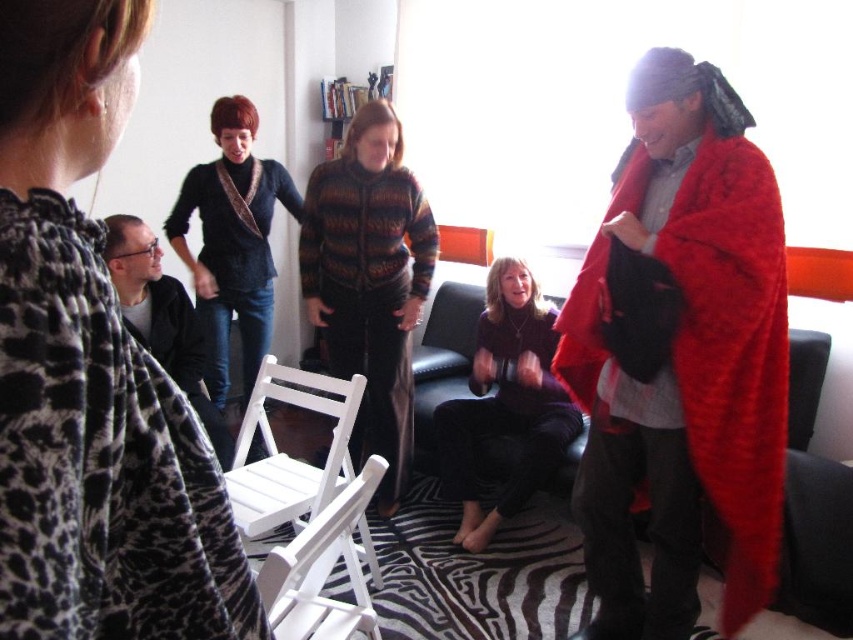
Question: Can you confirm if matte black sweater at center is thinner than white wood chair at lower left?

Choices:
 (A) yes
 (B) no

Answer: (A)

Question: Can you confirm if dark purple sweater at center is thinner than black leather chair at center?

Choices:
 (A) no
 (B) yes

Answer: (A)

Question: Which object is the closest to the dark purple sweater at center?

Choices:
 (A) white wood chair at center
 (B) black leather chair at center
 (C) velvet red blanket at right
 (D) knitted sweater at center

Answer: (B)

Question: Estimate the real-world distances between objects in this image. Which object is closer to the white wood chair at center?

Choices:
 (A) velvet red blanket at right
 (B) dark purple sweater at center

Answer: (A)

Question: Estimate the real-world distances between objects in this image. Which object is closer to the white wood chair at lower left?

Choices:
 (A) velvet red blanket at right
 (B) knitted sweater at center
 (C) matte black sweater at center

Answer: (B)

Question: Is velvet red blanket at right wider than knitted sweater at center?

Choices:
 (A) yes
 (B) no

Answer: (B)